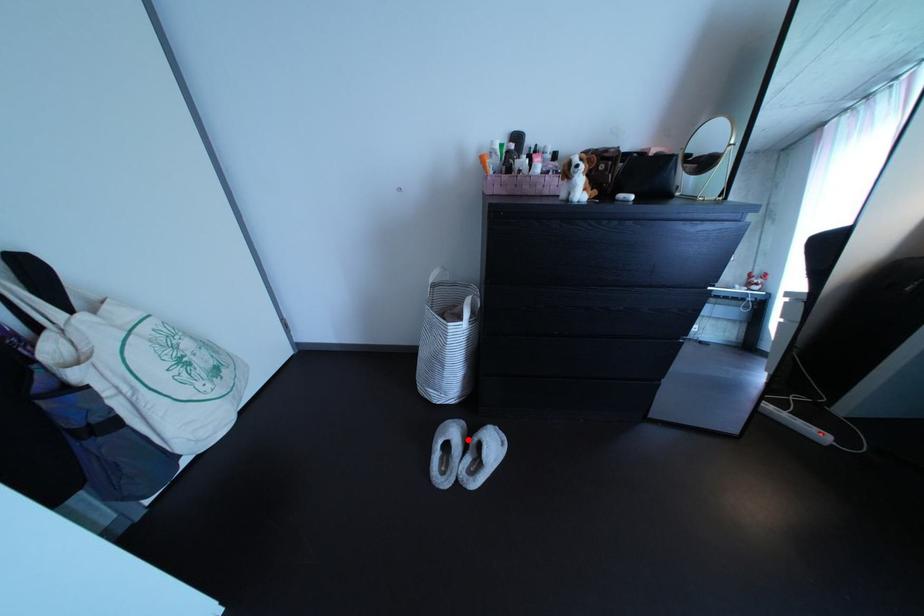
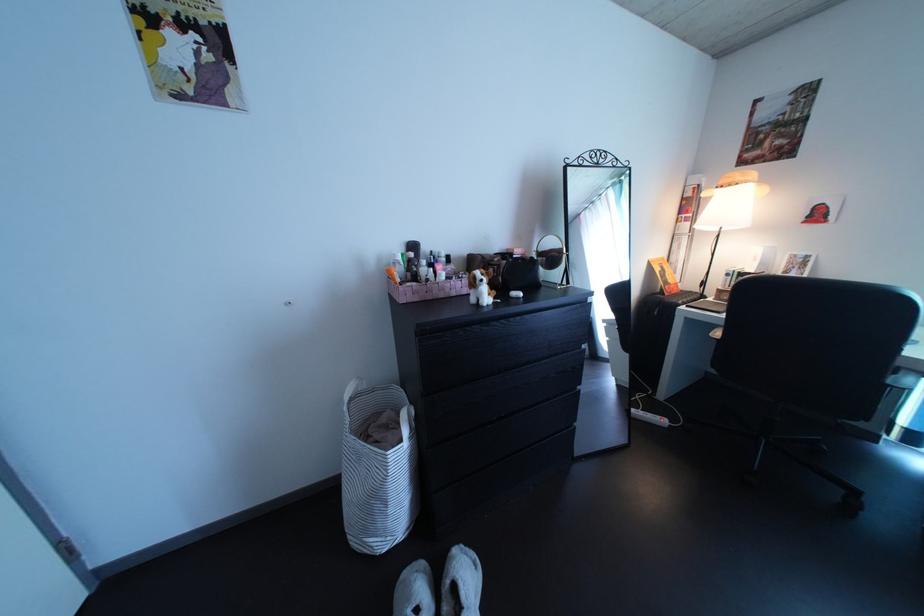
Question: I am providing you with two images of the same scene from different viewpoints. Given a red point in image1, look at the same physical point in image2. Is it:

Choices:
 (A) Closer to the viewpoint
 (B) Farther from the viewpoint

Answer: (A)